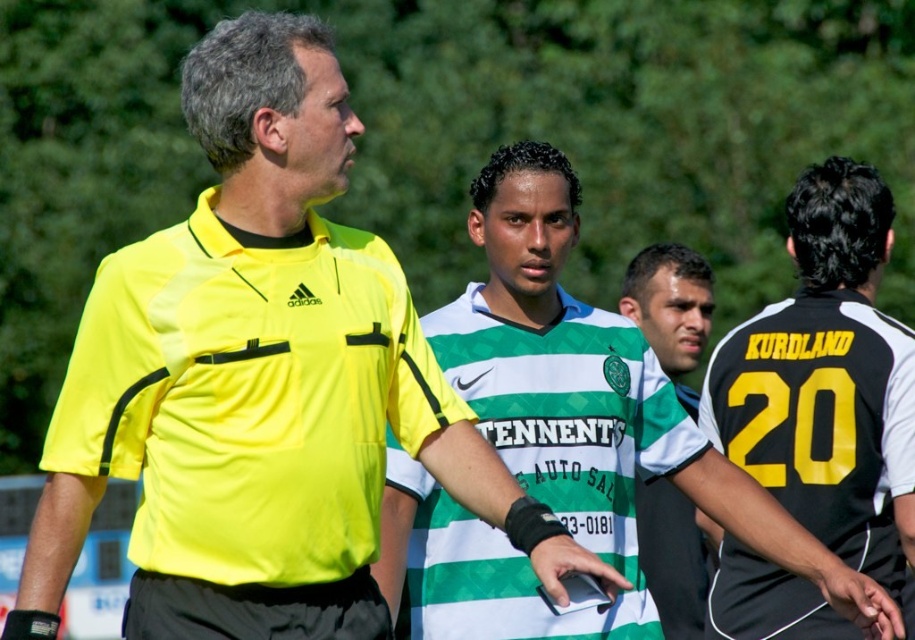
Question: Which of the following is the closest to the observer?

Choices:
 (A) yellow matte shirt at center
 (B) green and white jersey at center

Answer: (A)

Question: Which point appears farthest from the camera in this image?

Choices:
 (A) (817, 182)
 (B) (666, 632)
 (C) (408, 483)
 (D) (289, 241)

Answer: (B)

Question: Is green striped jersey at center wider than black/yellow jersey at center?

Choices:
 (A) no
 (B) yes

Answer: (B)

Question: Is black/yellow jersey at center thinner than green and white jersey at center?

Choices:
 (A) yes
 (B) no

Answer: (B)

Question: Observing the image, what is the correct spatial positioning of yellow matte shirt at center in reference to black/yellow jersey at center?

Choices:
 (A) right
 (B) left

Answer: (B)

Question: Which of the following is the closest to the observer?

Choices:
 (A) black/yellow jersey at center
 (B) green and white jersey at center
 (C) yellow matte shirt at center

Answer: (C)